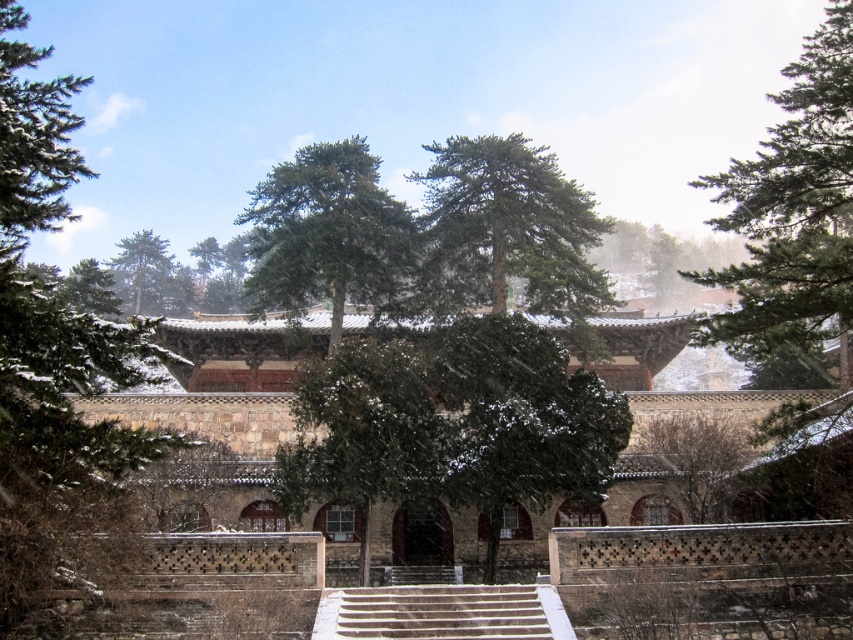
Question: From the image, what is the correct spatial relationship of green leafy tree at center in relation to green needle-like tree at upper center?

Choices:
 (A) above
 (B) below

Answer: (B)

Question: Which is farther from the green needle-like tree at upper center?

Choices:
 (A) green leafy tree at center
 (B) green matte tree at center

Answer: (A)

Question: Which object is positioned farthest from the green needle-like tree at upper center?

Choices:
 (A) green textured pine tree at center
 (B) green needle-like tree at upper right
 (C) bare branches at center

Answer: (B)

Question: Is green needle-like tree at center above green matte tree at center?

Choices:
 (A) yes
 (B) no

Answer: (B)

Question: Which point appears farthest from the camera in this image?

Choices:
 (A) (840, 10)
 (B) (347, 141)
 (C) (519, 198)
 (D) (454, 497)

Answer: (B)

Question: In this image, where is green needle-like tree at upper right located relative to bare branches at center?

Choices:
 (A) right
 (B) left

Answer: (A)